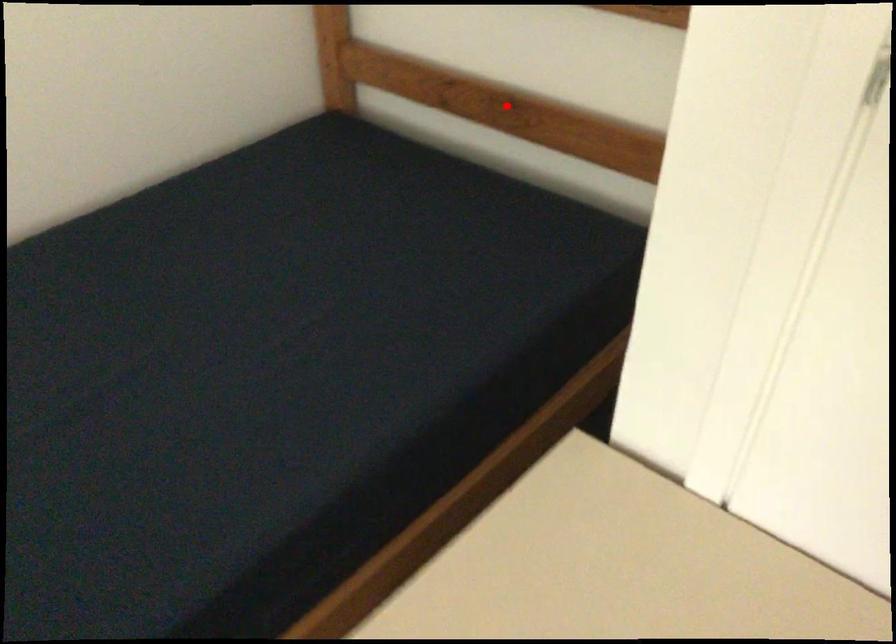
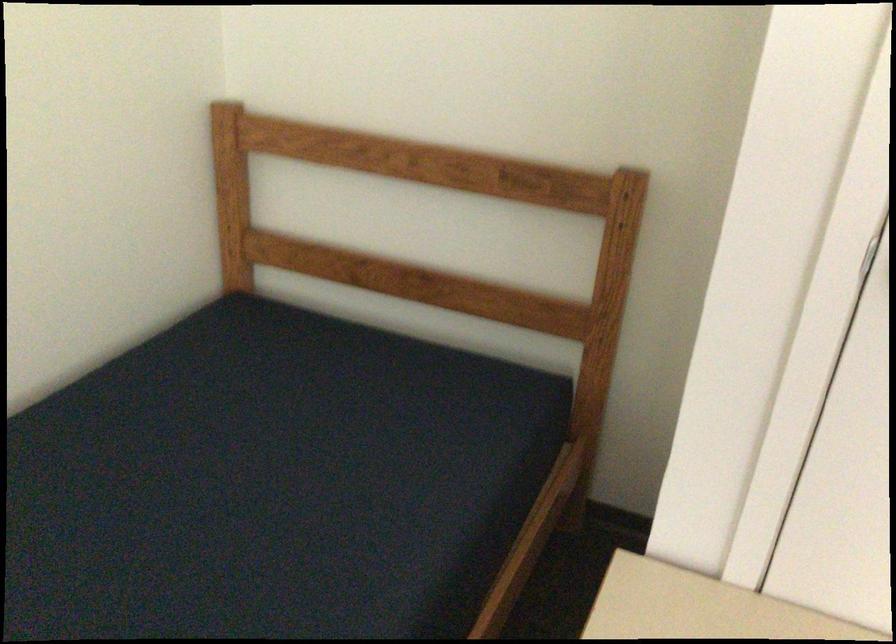
Question: I am providing you with two images of the same scene from different viewpoints. Given a red point in image1, look at the same physical point in image2. Is it:

Choices:
 (A) Closer to the viewpoint
 (B) Farther from the viewpoint

Answer: (B)